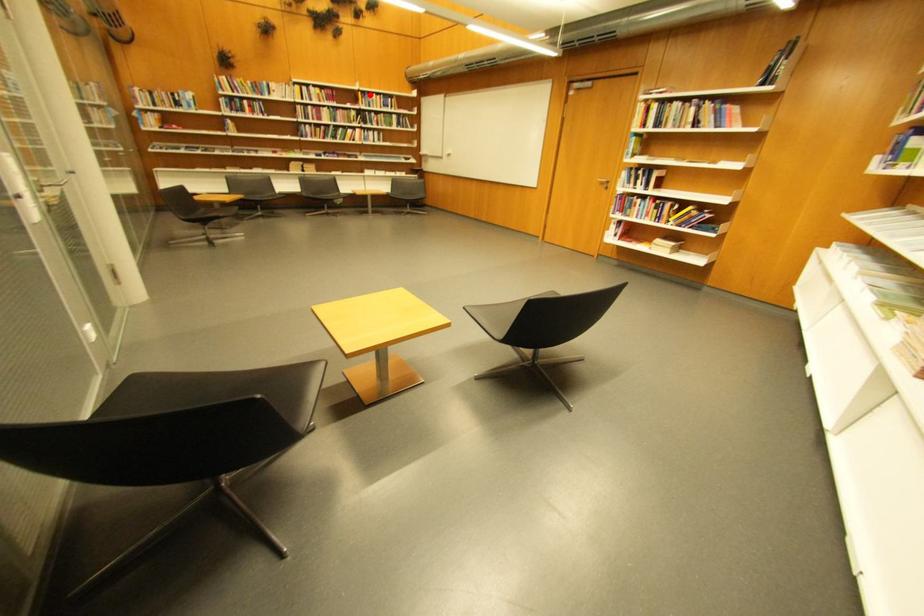
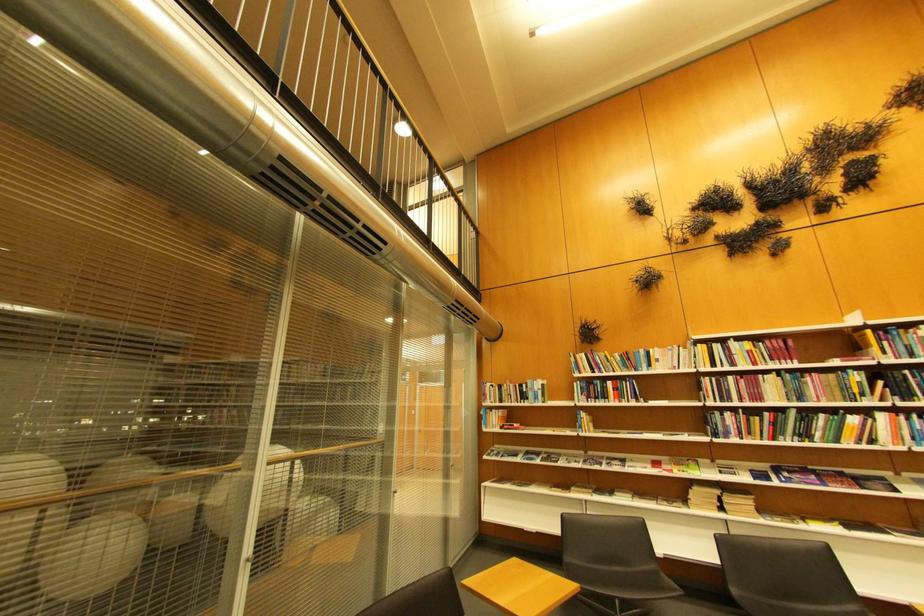
Locate, in the second image, the point that corresponds to the highlighted location in the first image.

(880, 333)